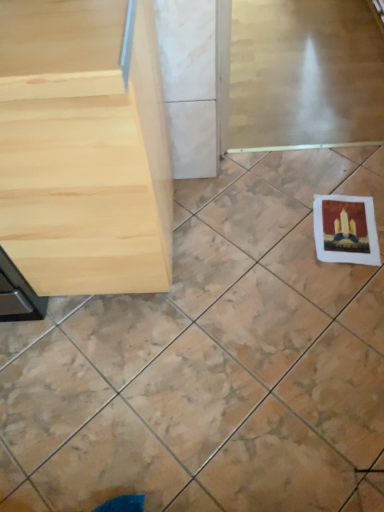
Question: Would you consider clear glass screen door at upper center to be distant from light wood table at left?

Choices:
 (A) no
 (B) yes

Answer: (B)

Question: From a real-world perspective, is clear glass screen door at upper center physically above light wood table at left?

Choices:
 (A) yes
 (B) no

Answer: (B)

Question: Can you confirm if clear glass screen door at upper center is smaller than light wood table at left?

Choices:
 (A) no
 (B) yes

Answer: (B)

Question: Is light wood table at left a part of clear glass screen door at upper center?

Choices:
 (A) no
 (B) yes

Answer: (A)

Question: Is clear glass screen door at upper center oriented away from light wood table at left?

Choices:
 (A) yes
 (B) no

Answer: (B)

Question: Is white matte coaster at lower right spatially inside clear glass screen door at upper center, or outside of it?

Choices:
 (A) outside
 (B) inside

Answer: (A)

Question: From a real-world perspective, is white matte coaster at lower right positioned above or below clear glass screen door at upper center?

Choices:
 (A) above
 (B) below

Answer: (B)

Question: Looking at the image, does white matte coaster at lower right seem bigger or smaller compared to clear glass screen door at upper center?

Choices:
 (A) small
 (B) big

Answer: (B)

Question: In terms of width, does white matte coaster at lower right look wider or thinner when compared to clear glass screen door at upper center?

Choices:
 (A) thin
 (B) wide

Answer: (B)

Question: From their relative heights in the image, would you say light wood table at left is taller or shorter than white matte coaster at lower right?

Choices:
 (A) short
 (B) tall

Answer: (B)

Question: Based on their sizes in the image, would you say light wood table at left is bigger or smaller than white matte coaster at lower right?

Choices:
 (A) small
 (B) big

Answer: (B)

Question: Looking at their shapes, would you say light wood table at left is wider or thinner than white matte coaster at lower right?

Choices:
 (A) wide
 (B) thin

Answer: (B)

Question: Is light wood table at left spatially inside white matte coaster at lower right, or outside of it?

Choices:
 (A) inside
 (B) outside

Answer: (B)

Question: From a real-world perspective, is matte paper postcard at lower right positioned above or below white matte coaster at lower right?

Choices:
 (A) above
 (B) below

Answer: (B)

Question: Which is correct: matte paper postcard at lower right is inside white matte coaster at lower right, or outside of it?

Choices:
 (A) inside
 (B) outside

Answer: (A)